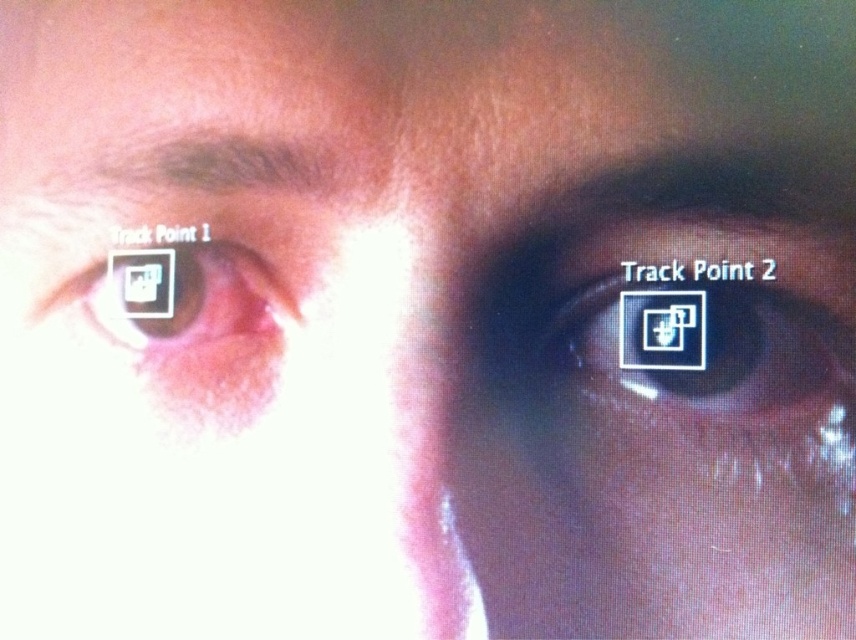
Which of these two, matte black eye at right or matte black eye at left, stands taller?

Standing taller between the two is matte black eye at left.

Can you confirm if matte black eye at right is positioned to the left of matte black eye at left?

In fact, matte black eye at right is to the right of matte black eye at left.

Between point (785, 364) and point (98, 296), which one is positioned in front?

Positioned in front is point (785, 364).

The height and width of the screenshot is (640, 856). What are the coordinates of `matte black eye at right` in the screenshot? It's located at (703, 348).